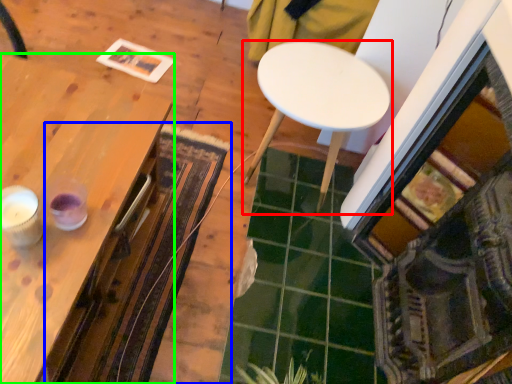
Question: Based on their relative distances, which object is farther from table (highlighted by a red box)? Choose from mat (highlighted by a blue box) and table (highlighted by a green box).

Choices:
 (A) mat
 (B) table

Answer: (B)